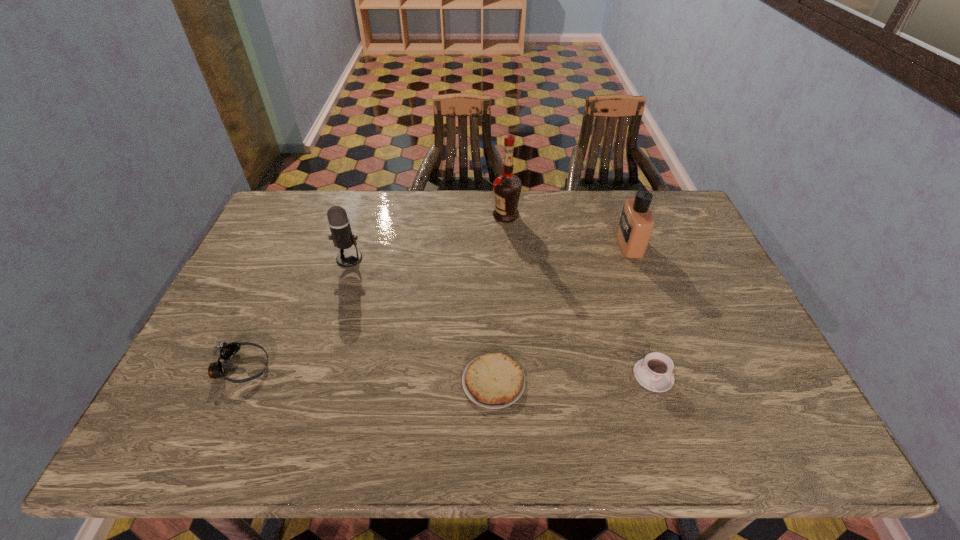
Locate an element on the screen. liquor is located at coordinates (507, 187).

Where is `the tallest object`? the tallest object is located at coordinates (507, 187).

Where is `the fifth object from right to left`? the fifth object from right to left is located at coordinates tap(339, 224).

This screenshot has height=540, width=960. I want to click on perfume, so click(636, 223).

Find the location of `teacup`. teacup is located at coordinates (654, 372).

Where is `the leftmost object`? the leftmost object is located at coordinates (225, 351).

This screenshot has width=960, height=540. What are the coordinates of `tortilla` in the screenshot? It's located at (495, 380).

What are the coordinates of `vacant space located 0.060m on the front and back of the liquor` in the screenshot? It's located at (475, 215).

In order to click on vacant space situated 0.230m on the front and back of the liquor in this screenshot , I will do click(x=426, y=215).

Locate an element on the screen. vacant area situated on the front and back of the liquor is located at coordinates (461, 215).